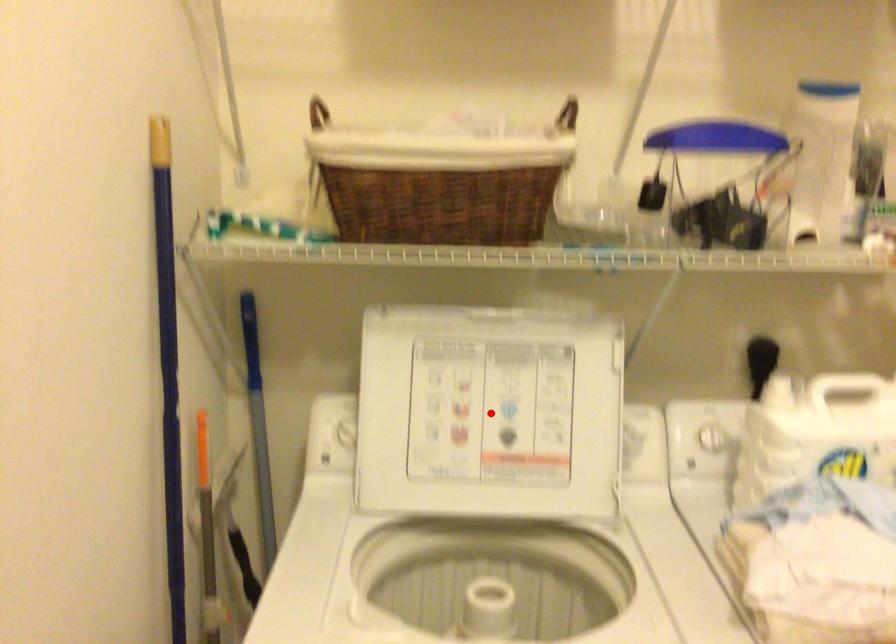
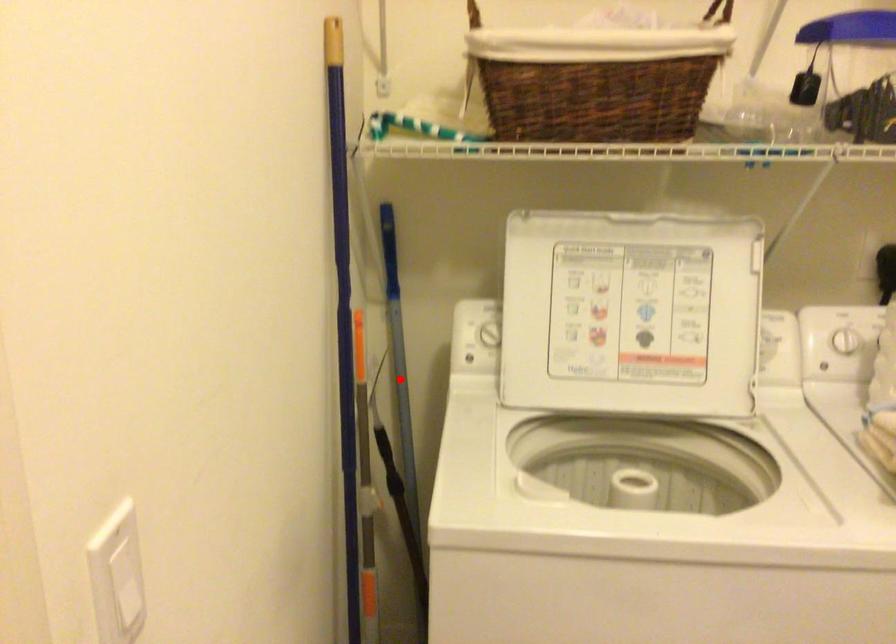
I am providing you with two images of the same scene from different viewpoints. A red point is marked on the first image and another point is marked on the second image. Do the highlighted points in image1 and image2 indicate the same real-world spot?

No